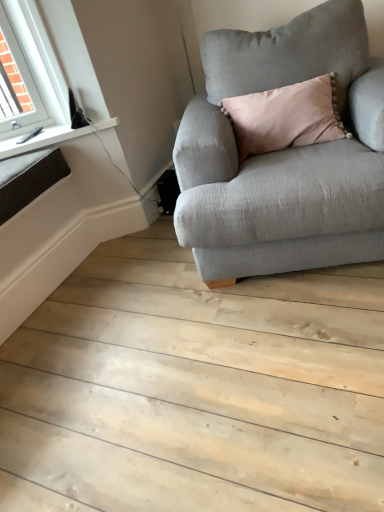
Question: Should I look upward or downward to see light gray fabric couch at center?

Choices:
 (A) up
 (B) down

Answer: (A)